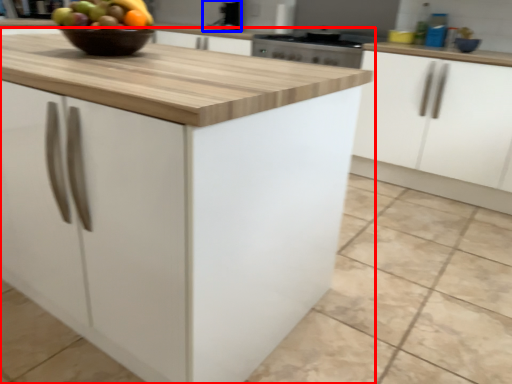
Question: Which of the following is the closest to the observer, cabinetry (highlighted by a red box) or sink (highlighted by a blue box)?

Choices:
 (A) cabinetry
 (B) sink

Answer: (A)